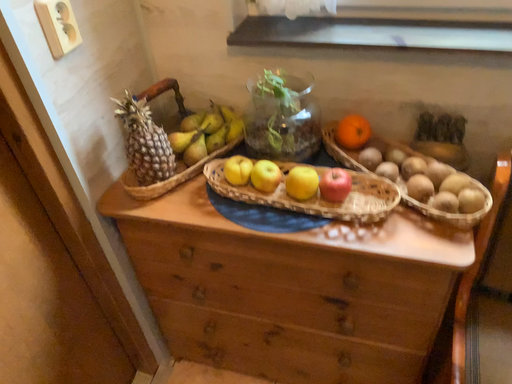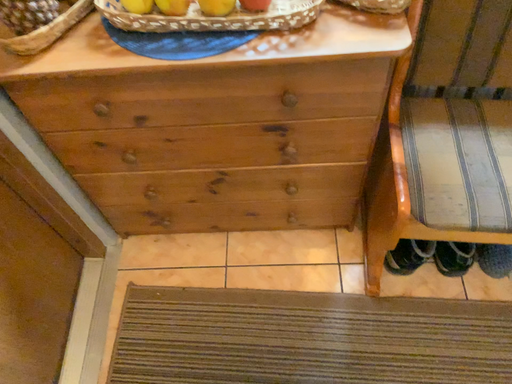
Question: How did the camera likely rotate when shooting the video?

Choices:
 (A) rotated right
 (B) rotated left

Answer: (A)